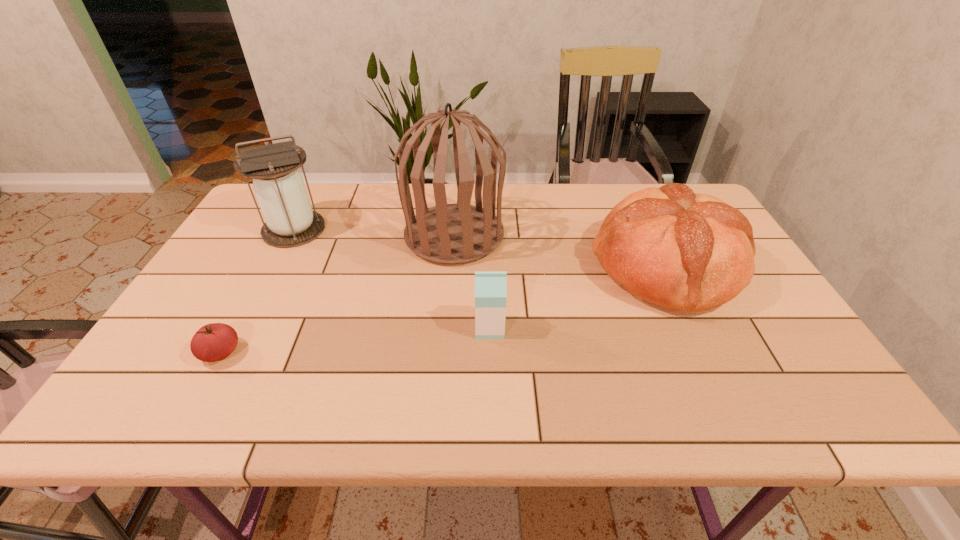
Image resolution: width=960 pixels, height=540 pixels. I want to click on free space between the tallest object and the bread, so click(560, 251).

The width and height of the screenshot is (960, 540). Find the location of `object that is the third closest to the shortest object`. object that is the third closest to the shortest object is located at coordinates (490, 287).

Locate an element on the screen. object identified as the fourth closest to the shortest object is located at coordinates (689, 252).

At what (x,y) coordinates should I click in order to perform the action: click on vacant area that satisfies the following two spatial constraints: 1. on the back side of the tomato; 2. on the right side of the rightmost object. Please return your answer as a coordinate pair (x, y). Image resolution: width=960 pixels, height=540 pixels. Looking at the image, I should click on (268, 267).

I want to click on blank space that satisfies the following two spatial constraints: 1. on the front side of the milk carton; 2. on the right side of the birdcage, so click(x=447, y=328).